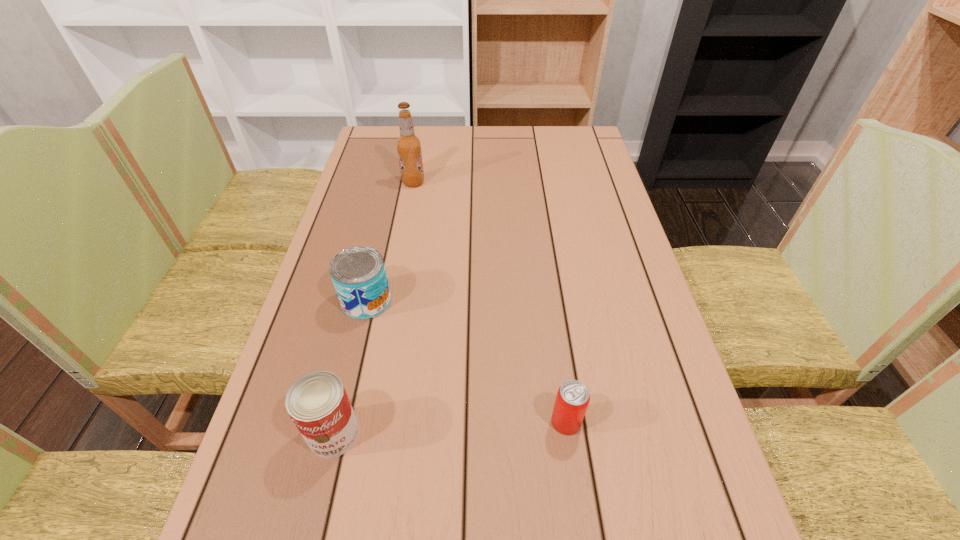
Locate an element on the screen. the farthest object is located at coordinates (408, 145).

This screenshot has height=540, width=960. In order to click on the tallest object in this screenshot , I will do `click(408, 145)`.

Image resolution: width=960 pixels, height=540 pixels. Find the location of `the third nearest object`. the third nearest object is located at coordinates (358, 273).

In order to click on the rightmost object in this screenshot , I will do `click(572, 399)`.

Identify the location of free space located 0.230m on the front label of the beer bottle. (499, 183).

I want to click on vacant space located 0.090m on the front of the third nearest object, so click(354, 354).

You are a GUI agent. You are given a task and a screenshot of the screen. Output one action in this format:
    pyautogui.click(x=<x>, y=<y>)
    Task: Click on the free space located 0.090m on the right of the rightmost object
    
    Given the screenshot: What is the action you would take?
    pyautogui.click(x=630, y=422)

I want to click on beer bottle that is at the left edge, so click(408, 145).

Find the location of `free space at the far edge of the desktop`. free space at the far edge of the desktop is located at coordinates coord(508,151).

The image size is (960, 540). Identify the location of vacant space at the right edge of the desktop. (592, 172).